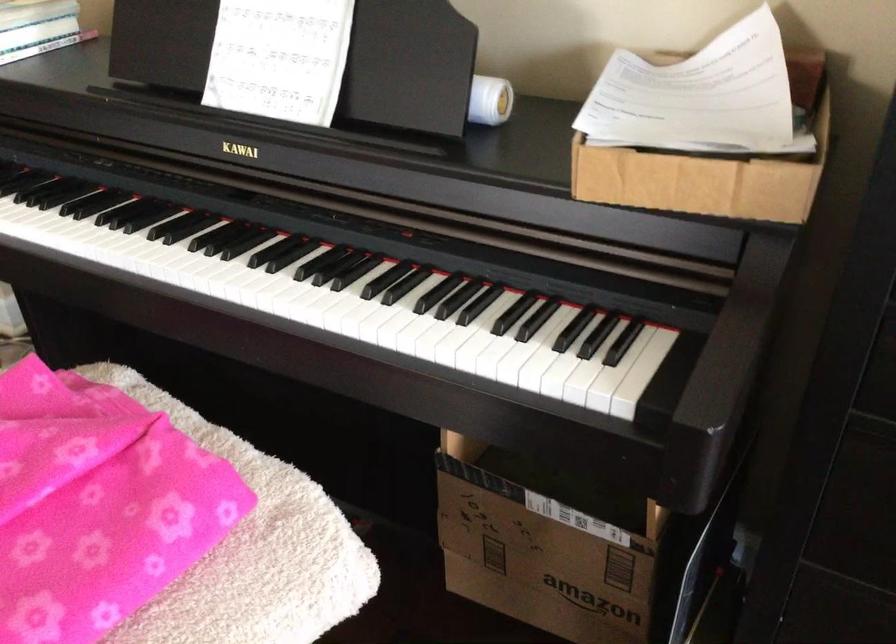
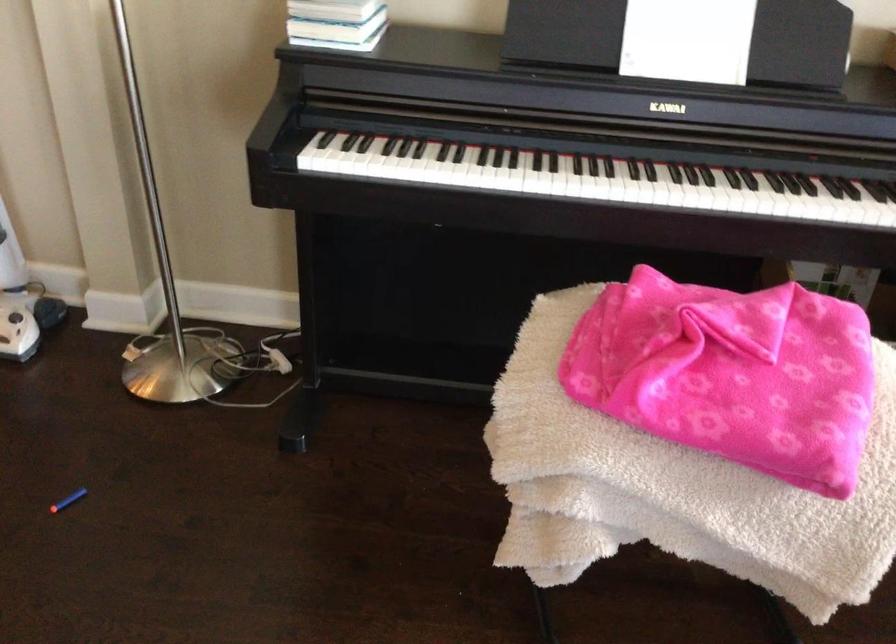
Question: In a continuous first-person perspective shot, in which direction is the camera moving?

Choices:
 (A) Left
 (B) Right
 (C) Forward
 (D) Backward

Answer: (A)